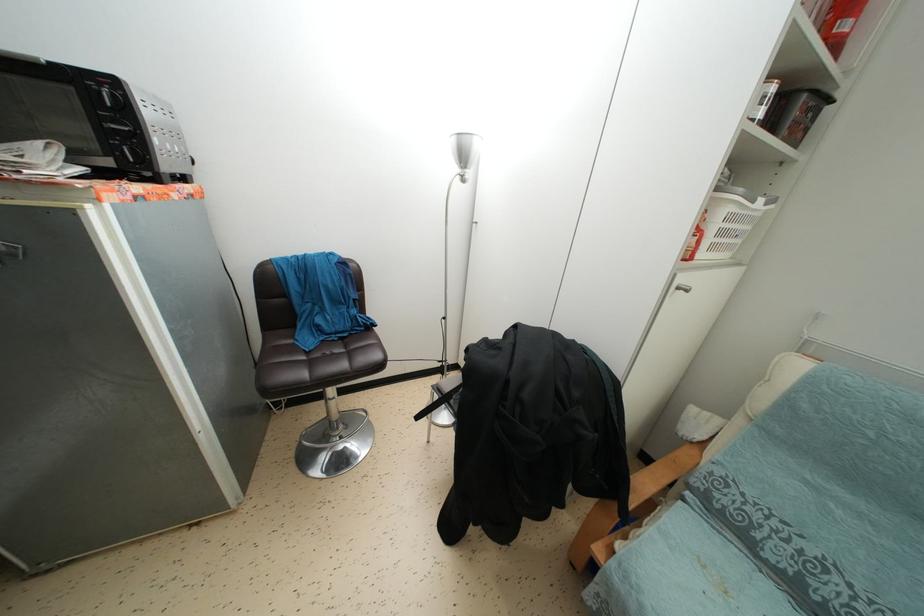
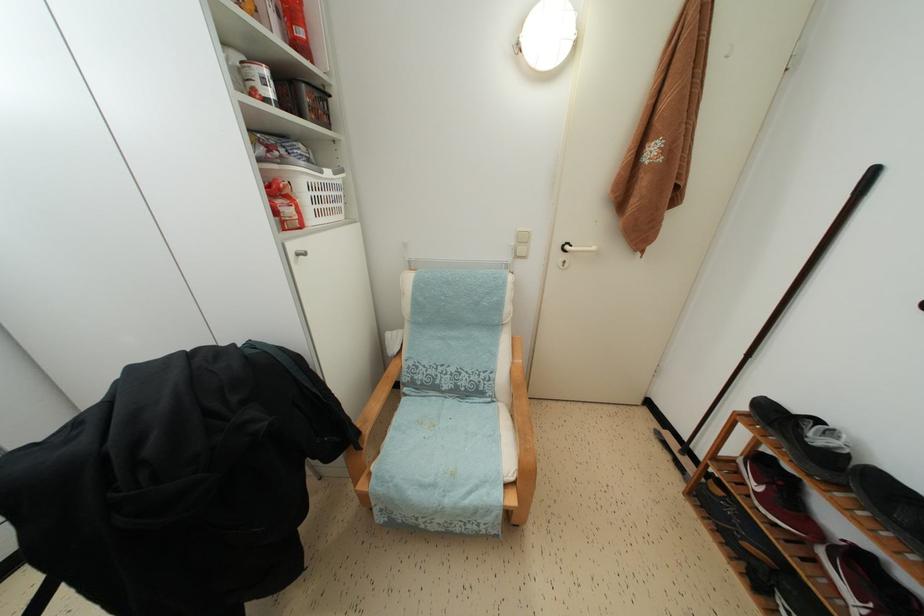
The images are taken continuously from a first-person perspective. In which direction is your viewpoint rotating?

The rotation direction of the camera is right-down.